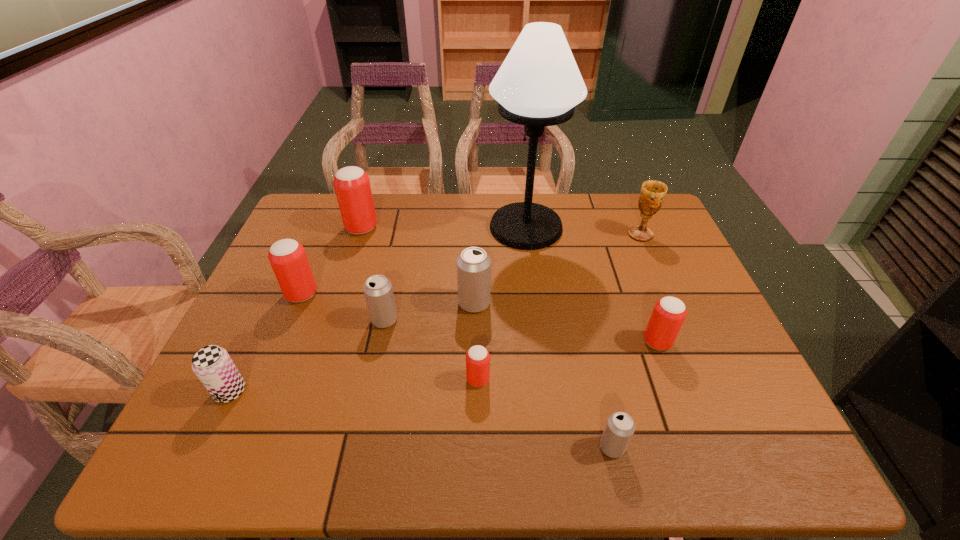
Locate an element on the screen. The image size is (960, 540). the leftmost white beer can is located at coordinates (378, 291).

This screenshot has width=960, height=540. I want to click on the fourth object from left to right, so 378,291.

This screenshot has height=540, width=960. Identify the location of purple beer can. (212, 364).

This screenshot has height=540, width=960. Identify the location of the nearest red beer can. (477, 357).

Locate an element on the screen. The image size is (960, 540). the smallest red beer can is located at coordinates (477, 357).

Locate an element on the screen. The image size is (960, 540). the nearest beer can is located at coordinates (620, 427).

You are a GUI agent. You are given a task and a screenshot of the screen. Output one action in this format:
    pyautogui.click(x=<x>, y=<y>)
    Task: Click on the nearest white beer can
    
    Given the screenshot: What is the action you would take?
    pyautogui.click(x=620, y=427)

What are the coordinates of `vacant region located on the left of the tallest object` in the screenshot? It's located at (418, 227).

Find the location of a particular element. Image resolution: width=960 pixels, height=540 pixels. free space located 0.180m on the left of the biggest red beer can is located at coordinates (289, 228).

Find the location of a particular element. Image resolution: width=960 pixels, height=540 pixels. vacant space located on the left of the rightmost object is located at coordinates (570, 235).